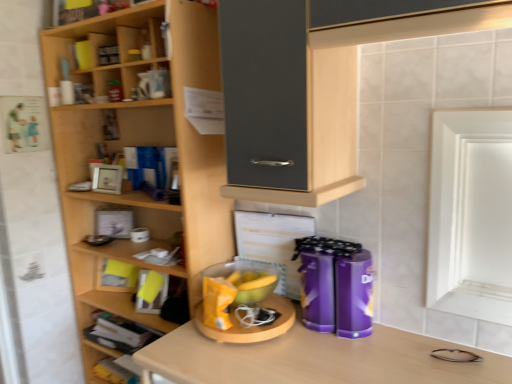
The height and width of the screenshot is (384, 512). Identify the location of free spot in front of purple glossy canisters at center, arranged as the first appliance when viewed from the right. (317, 359).